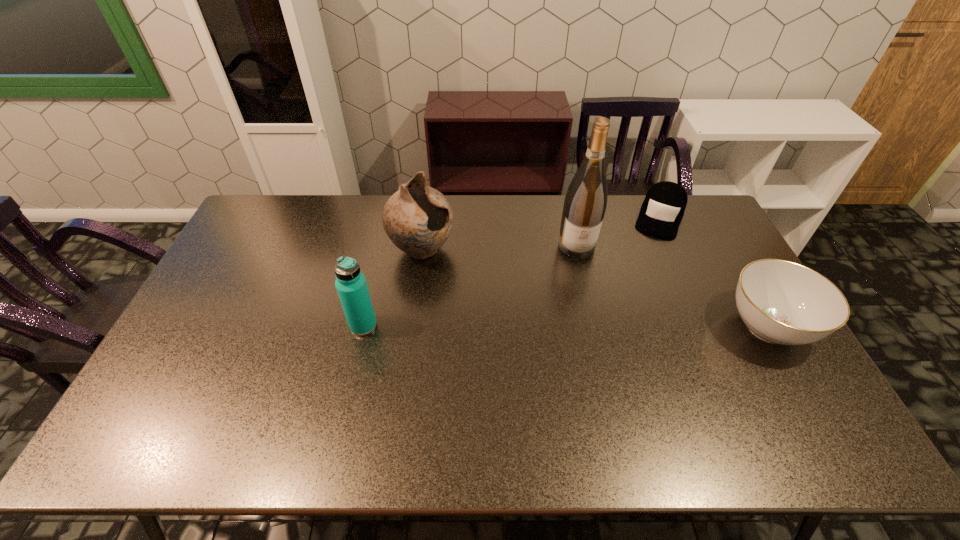
Locate an element on the screen. This screenshot has height=540, width=960. free space that is in between the cap and the fourth tallest object is located at coordinates (713, 272).

Identify the location of blank region between the pottery and the third shortest object. (393, 288).

Where is `free spot between the pottery and the water bottle`? The width and height of the screenshot is (960, 540). free spot between the pottery and the water bottle is located at coordinates (393, 288).

Find the location of a particular element. Image resolution: width=960 pixels, height=540 pixels. unoccupied area between the pottery and the cap is located at coordinates (540, 233).

You are a GUI agent. You are given a task and a screenshot of the screen. Output one action in this format:
    pyautogui.click(x=<x>, y=<y>)
    Task: Click on the free space between the shortest object and the water bottle
    
    Given the screenshot: What is the action you would take?
    pyautogui.click(x=512, y=272)

I want to click on vacant space in between the chinaware and the third tallest object, so click(x=565, y=326).

At what (x,y) coordinates should I click in order to perform the action: click on free spot between the shortest object and the pottery. Please return your answer as a coordinate pair (x, y). The width and height of the screenshot is (960, 540). Looking at the image, I should click on (540, 233).

This screenshot has height=540, width=960. I want to click on vacant space in between the wine bottle and the chinaware, so [x=672, y=286].

Locate an element on the screen. The width and height of the screenshot is (960, 540). free spot between the pottery and the tallest object is located at coordinates (499, 248).

Point out which object is positioned as the nearest to the pottery. Please provide its 2D coordinates. Your answer should be formatted as a tuple, i.e. [(x, y)], where the tuple contains the x and y coordinates of a point satisfying the conditions above.

[(351, 286)]